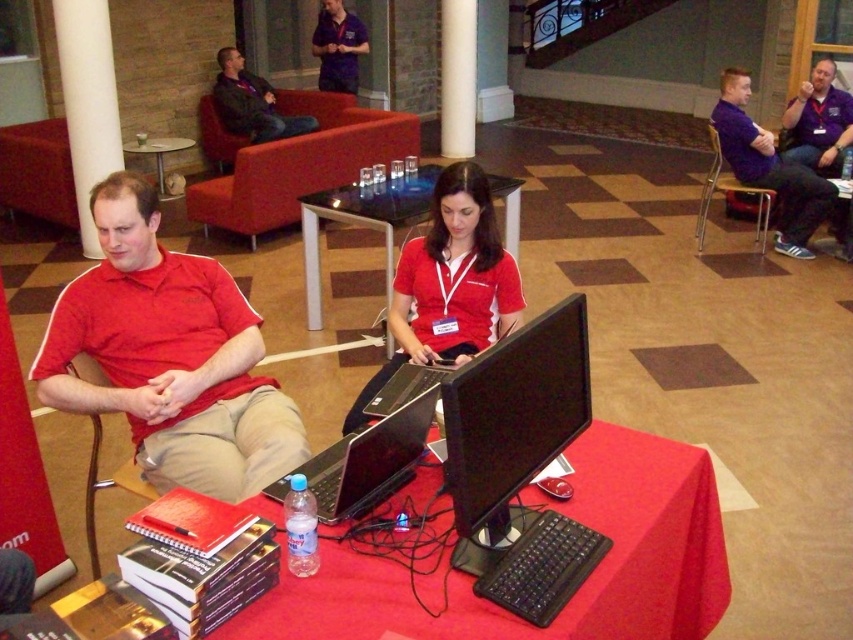
Is point (161, 355) in front of point (457, 93)?

Yes.

What do you see at coordinates (169, 356) in the screenshot?
I see `red cotton polo shirt at left` at bounding box center [169, 356].

At what (x,y) coordinates should I click in order to perform the action: click on red cotton polo shirt at left. Please return your answer as a coordinate pair (x, y). The image size is (853, 640). Looking at the image, I should click on (169, 356).

In the scene shown: Which is above, red cotton polo shirt at left or dark blue jacket at upper center?

dark blue jacket at upper center is higher up.

Is red cotton polo shirt at left to the left of dark blue jacket at upper center from the viewer's perspective?

No, red cotton polo shirt at left is not to the left of dark blue jacket at upper center.

This screenshot has width=853, height=640. I want to click on red cotton polo shirt at left, so click(x=169, y=356).

Does black glossy monitor at center have a greater width compared to glass transparent table at upper center?

Incorrect, black glossy monitor at center's width does not surpass glass transparent table at upper center's.

Which is more to the right, black glossy monitor at center or glass transparent table at upper center?

black glossy monitor at center

Between point (457, 531) and point (149, 150), which one is positioned in front?

Point (457, 531) is in front.

Locate an element on the screen. This screenshot has height=640, width=853. black glossy monitor at center is located at coordinates (512, 426).